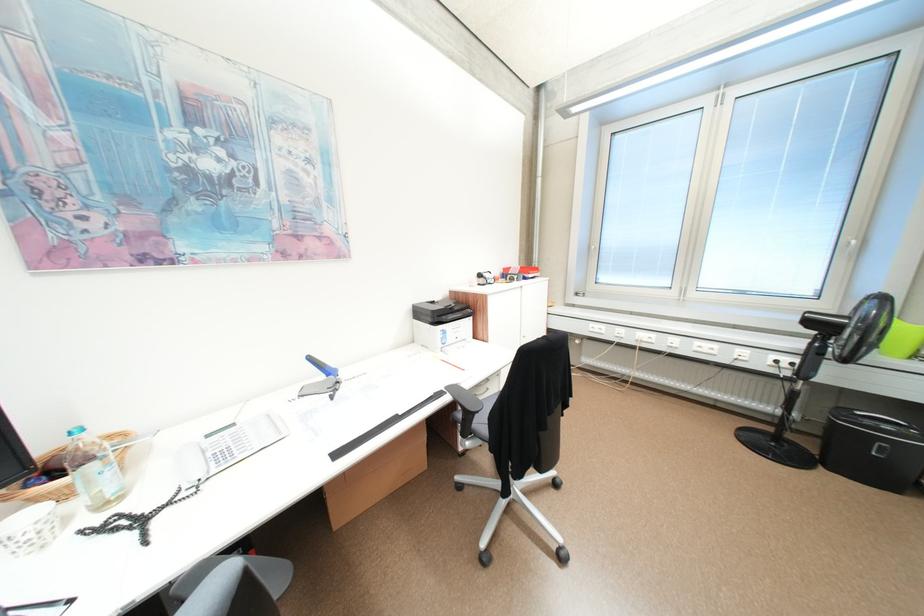
Identify the location of telephone handset. (226, 447).